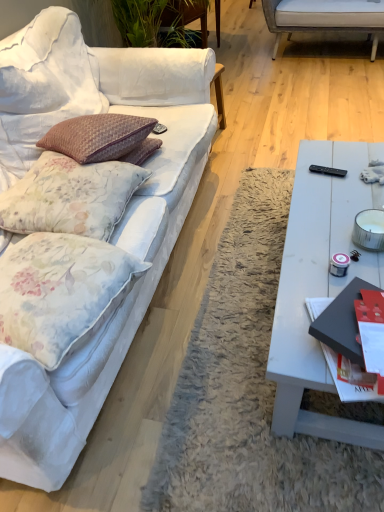
Find the location of `vacant space to the right of black plastic remote control at right`. vacant space to the right of black plastic remote control at right is located at coordinates (359, 168).